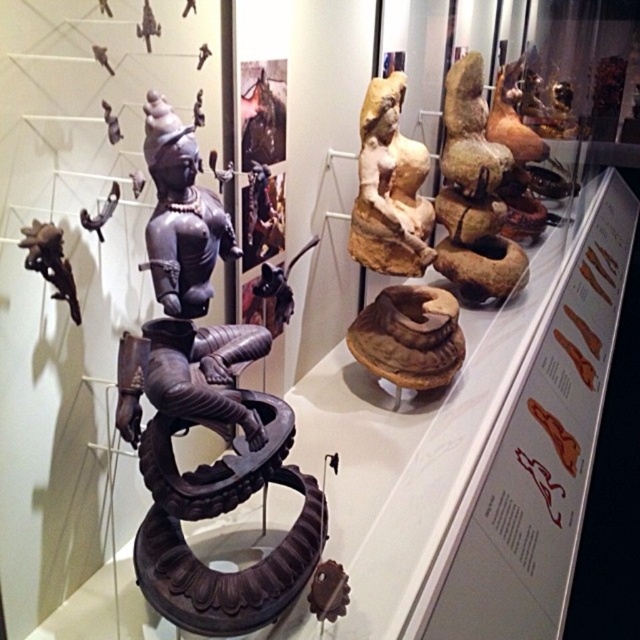
Between black polished wood statue at center and matte beige statue at center, which one is positioned lower?

Positioned lower is black polished wood statue at center.

Is black polished wood statue at center positioned behind matte beige statue at center?

No, black polished wood statue at center is in front of matte beige statue at center.

You are a GUI agent. You are given a task and a screenshot of the screen. Output one action in this format:
    pyautogui.click(x=<x>, y=<y>)
    Task: Click on the black polished wood statue at center
    This screenshot has height=640, width=640.
    Given the screenshot: What is the action you would take?
    pyautogui.click(x=204, y=412)